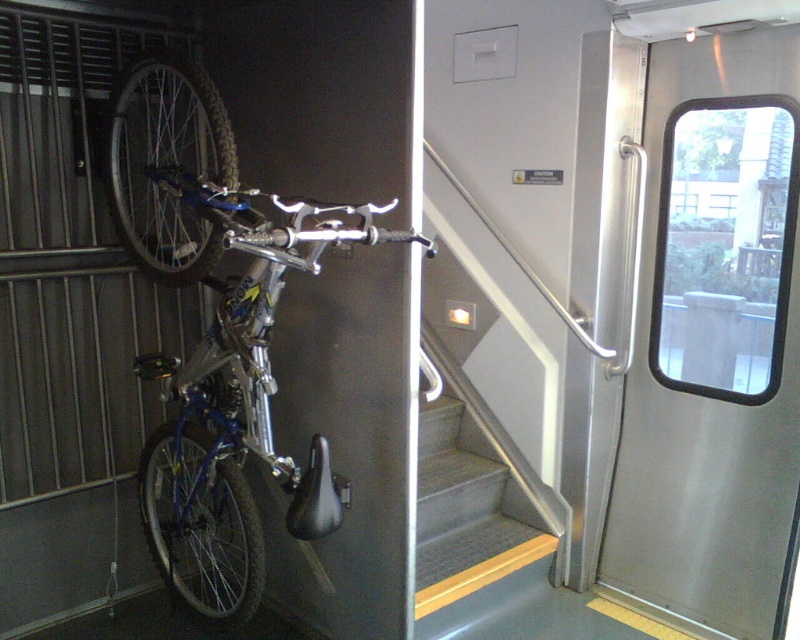
Does blue metallic bicycle at left have a lesser width compared to gray carpeted stairs at center?

Incorrect, blue metallic bicycle at left's width is not less than gray carpeted stairs at center's.

Is point (180, 380) less distant than point (501, 573)?

Yes, point (180, 380) is closer to viewer.

This screenshot has width=800, height=640. What are the coordinates of `blue metallic bicycle at left` in the screenshot? It's located at (237, 404).

At what (x,y) coordinates should I click in order to perform the action: click on blue metallic bicycle at left. Please return your answer as a coordinate pair (x, y). This screenshot has height=640, width=800. Looking at the image, I should click on (237, 404).

Is polished stainless steel door at right smaller than gray carpeted stairs at center?

Actually, polished stainless steel door at right might be larger than gray carpeted stairs at center.

Does point (621, 554) lie behind point (418, 515)?

Yes, it is.

What do you see at coordinates (704, 404) in the screenshot?
I see `polished stainless steel door at right` at bounding box center [704, 404].

Identify the location of polished stainless steel door at right. This screenshot has width=800, height=640. (704, 404).

Is point (788, 378) less distant than point (240, 419)?

Yes.

Is polished stainless steel door at right positioned in front of blue metallic bicycle at left?

No, it is not.

Does point (782, 60) come farther from viewer compared to point (178, 422)?

Yes, point (782, 60) is behind point (178, 422).

Locate an element on the screen. This screenshot has height=640, width=800. polished stainless steel door at right is located at coordinates (704, 404).